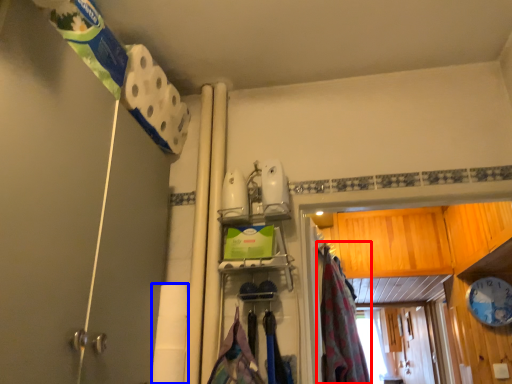
Question: Which object is further to the camera taking this photo, curtain (highlighted by a red box) or toilet paper (highlighted by a blue box)?

Choices:
 (A) curtain
 (B) toilet paper

Answer: (A)